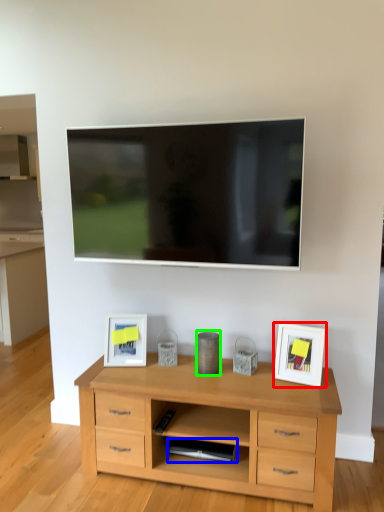
Question: Estimate the real-world distances between objects in this image. Which object is closer to picture frame (highlighted by a red box), appliance (highlighted by a blue box) or appliance (highlighted by a green box)?

Choices:
 (A) appliance
 (B) appliance

Answer: (B)